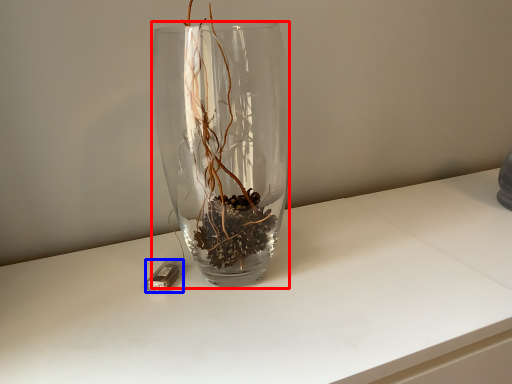
Question: Which object is further to the camera taking this photo, vase (highlighted by a red box) or candle holder (highlighted by a blue box)?

Choices:
 (A) vase
 (B) candle holder

Answer: (B)